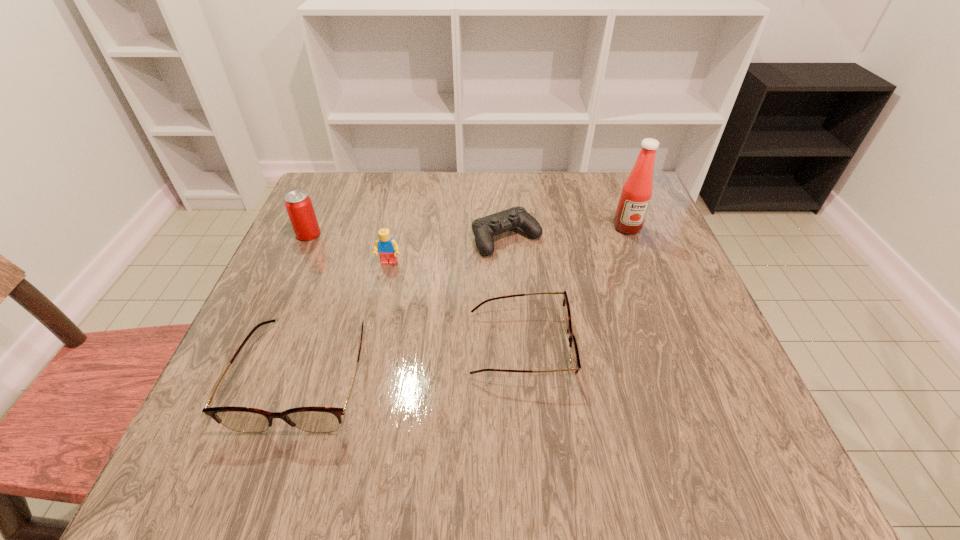
Identify the location of vacant area that lies between the rightmost object and the right spectacles. The width and height of the screenshot is (960, 540). (573, 287).

The image size is (960, 540). What are the coordinates of `empty space that is in between the Lego and the fifth shortest object` in the screenshot? It's located at (348, 249).

In order to click on empty space that is in between the control and the rightmost object in this screenshot , I will do `click(567, 233)`.

Identify the location of vacant area that lies between the control and the fourth tallest object. (406, 306).

In order to click on free point between the tallest object and the taller spectacles in this screenshot , I will do `click(467, 301)`.

Locate an element on the screen. Image resolution: width=960 pixels, height=540 pixels. unoccupied area between the taller spectacles and the can is located at coordinates (307, 305).

This screenshot has width=960, height=540. I want to click on free space between the taller spectacles and the control, so click(x=406, y=306).

Choose which object is the second nearest neighbor to the fifth shortest object. Please provide its 2D coordinates. Your answer should be formatted as a tuple, i.e. [(x, y)], where the tuple contains the x and y coordinates of a point satisfying the conditions above.

[(313, 419)]

Choose which object is the nearest neighbor to the condiment. Please provide its 2D coordinates. Your answer should be formatted as a tuple, i.e. [(x, y)], where the tuple contains the x and y coordinates of a point satisfying the conditions above.

[(484, 228)]

The width and height of the screenshot is (960, 540). Find the location of `free spot that satisfies the following two spatial constraints: 1. on the face of the shorter spectacles; 2. on the face of the third shortest object`. free spot that satisfies the following two spatial constraints: 1. on the face of the shorter spectacles; 2. on the face of the third shortest object is located at coordinates (521, 375).